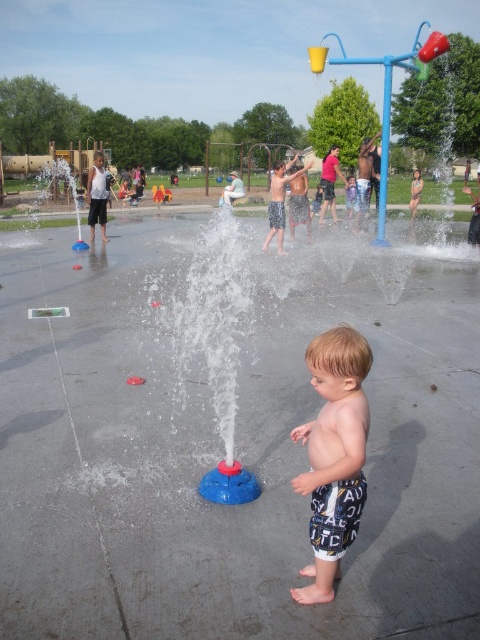
You are a photographer at the splash pad and want to capture the light brown hair at center and the smooth skin child at center in a single photo. Since the camera can only focus on one subject clearly, which subject should you choose to ensure the other remains in the background?

Since the light brown hair at center is shorter than smooth skin child at center, you should focus on the smooth skin child at center to keep the light brown hair at center in the background.

You are a photographer taking a picture of the light brown hair at center and the smooth skin child at center. Which object should you focus on first if you want to capture both in one frame?

The light brown hair at center is to the left of smooth skin child at center, so you should focus on the light brown hair at center first to ensure both are in frame.